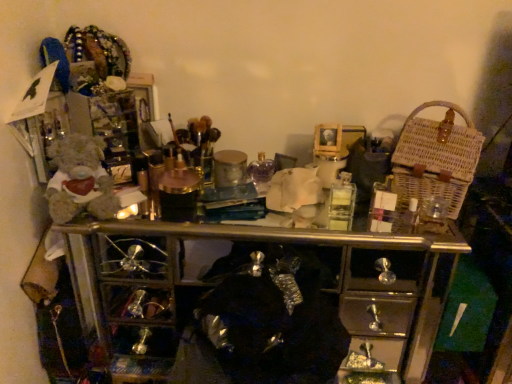
Image resolution: width=512 pixels, height=384 pixels. Describe the element at coordinates (436, 157) in the screenshot. I see `woven brown basket at right` at that location.

The width and height of the screenshot is (512, 384). I want to click on woven brown basket at right, so click(x=436, y=157).

Identify the location of woven brown basket at right. (436, 157).